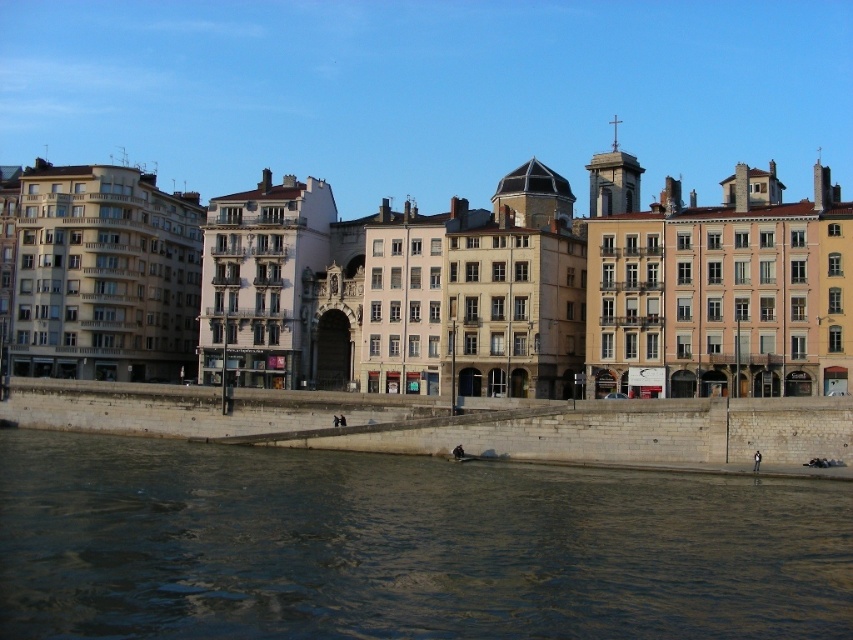
You are a painter who wants to capture the riverside scene. You notice the dark water at lower center and the stone embankment at lower center. Which of these two features is narrower in width?

The dark water at lower center has a lesser width compared to the stone embankment at lower center, so the dark water at lower center is narrower.

You are standing at the edge of the riverside scene and want to know where the dark water at lower center is positioned relative to the stone embankment. Can you determine its location?

The dark water at lower center is located at point (403, 547), which places it near the lower part of the scene, likely just beyond the stone embankment mentioned in the scene description.